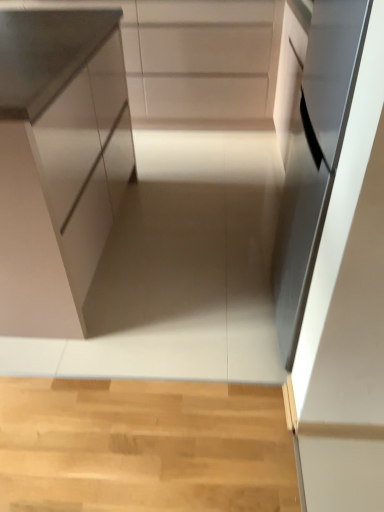
Where is `vacant space in front of satin black oven at right`? Image resolution: width=384 pixels, height=512 pixels. vacant space in front of satin black oven at right is located at coordinates (277, 425).